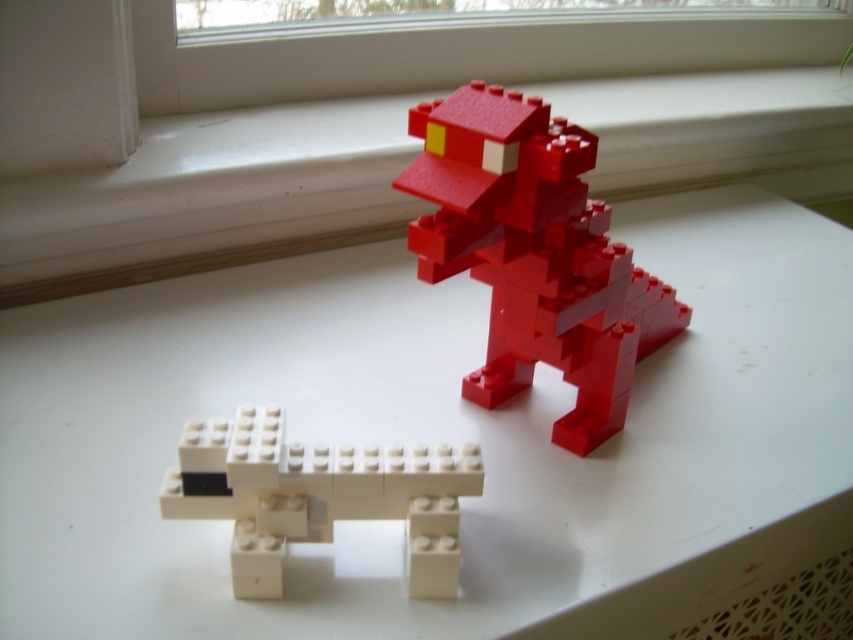
You are standing in front of a white matte table at center and want to place a 24 inch long LEGO dinosaur on it. Can the LEGO dinosaur fit on the table?

The white matte table at center is 25.55 inches away from the viewer, but the question is about the table size. Since the table size isn

Based on the photo, you are arranging a display and need to place a small plant between the white matte table at center and the matte plastic dinosaur at upper center. Based on their positions, which object should the plant be closer to?

The white matte table at center is positioned on the left side of the matte plastic dinosaur at upper center, so the plant should be placed closer to the white matte table at center to maintain symmetry between the two objects.